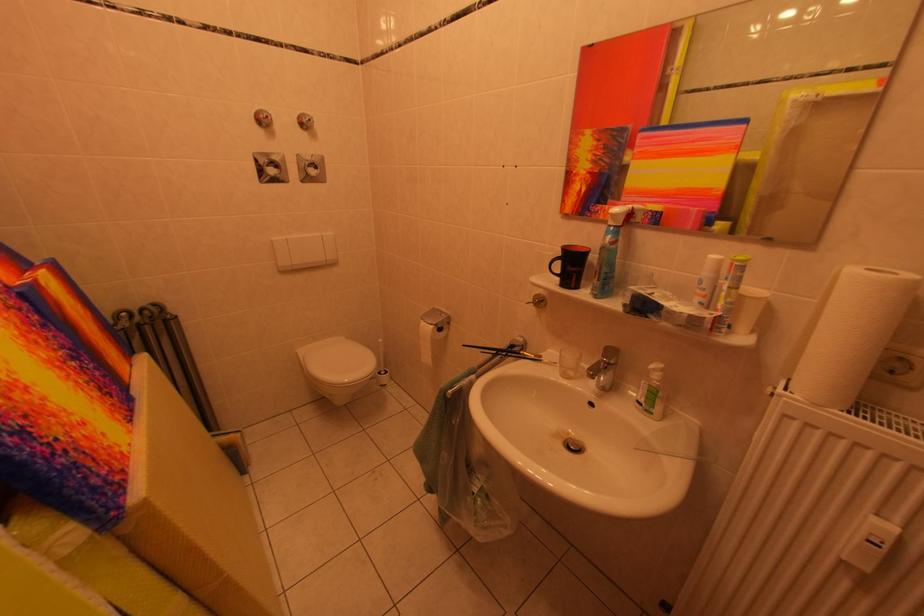
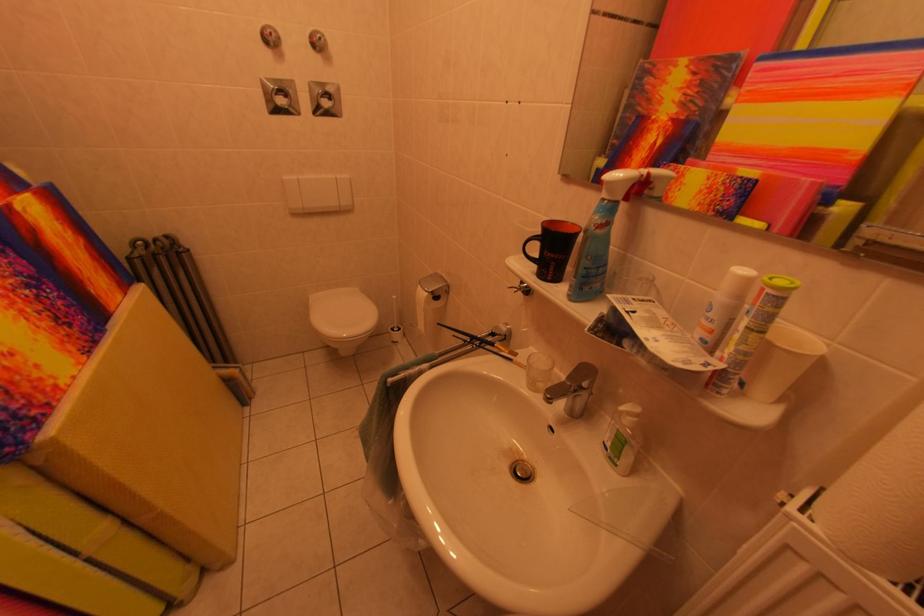
Locate, in the second image, the point that corresponds to pixel 322 172 in the first image.

(334, 103)